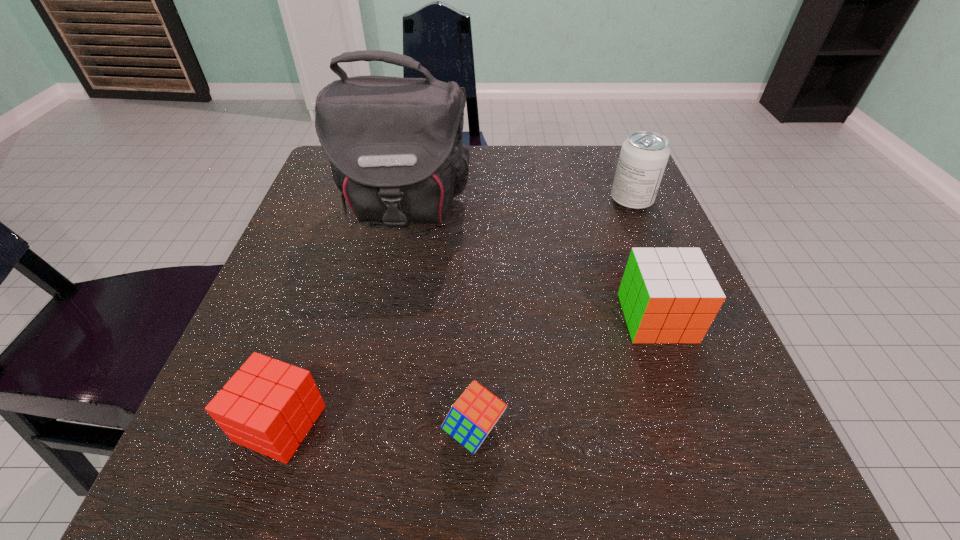
Identify the location of the tallest object. (395, 146).

Where is `the fourth shortest object`? Image resolution: width=960 pixels, height=540 pixels. the fourth shortest object is located at coordinates (643, 158).

Find the location of a particular element. The image size is (960, 540). the rightmost cube is located at coordinates (668, 295).

This screenshot has height=540, width=960. What are the coordinates of `the tallest cube` in the screenshot? It's located at (668, 295).

The width and height of the screenshot is (960, 540). In order to click on the leftmost cube in this screenshot , I will do `click(269, 406)`.

Where is `the shortest cube`? This screenshot has width=960, height=540. the shortest cube is located at coordinates (470, 419).

Image resolution: width=960 pixels, height=540 pixels. I want to click on the shortest object, so click(470, 419).

Where is `blank space located 0.080m on the open flap of the tallest object`? The height and width of the screenshot is (540, 960). blank space located 0.080m on the open flap of the tallest object is located at coordinates (390, 278).

I want to click on vacant space located 0.360m on the front of the soda can, so click(x=698, y=360).

At what (x,y) coordinates should I click in order to perform the action: click on vacant space positioned 0.120m on the left of the rightmost cube. Please return your answer as a coordinate pair (x, y). Looking at the image, I should click on (550, 318).